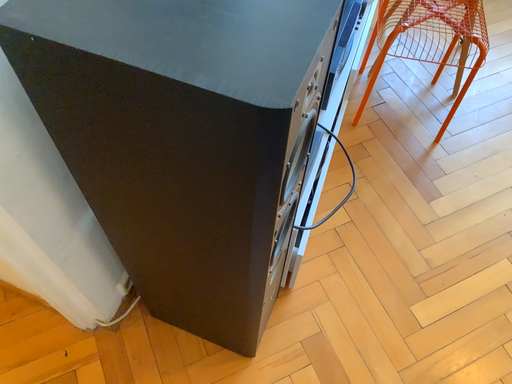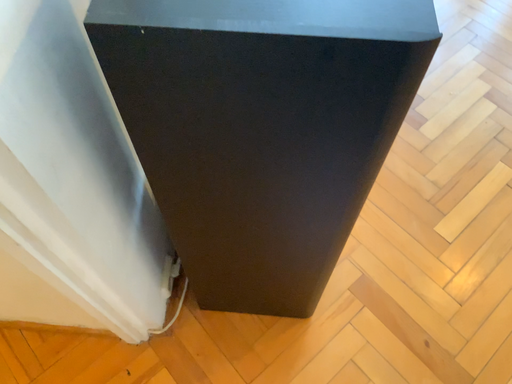
Question: Which way did the camera rotate in the video?

Choices:
 (A) rotated left
 (B) rotated right

Answer: (B)